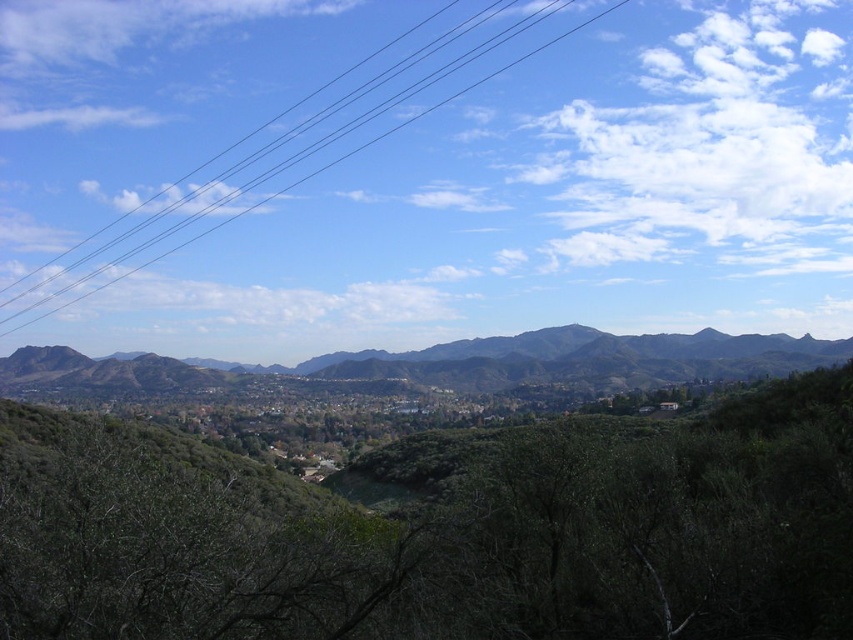
From the picture: You are standing at the edge of the hilly landscape and looking towards the center. You see a green leafy tree at center and a green textured mountain at center. Which object is positioned higher in your field of view?

The green leafy tree at center is positioned higher in your field of view because it is above the green textured mountain at center.

You are a drone operator planning to fly your drone from the green textured mountain at center to the black wire at upper center. Based on the scene, can you determine which object is taller?

The green textured mountain at center is not as tall as the black wire at upper center, so the black wire at upper center is taller.

You are a hiker planning to take a photo of the green textured mountain at center and the black wire at upper center. Which object should you position to your left side when framing the shot?

The black wire at upper center should be positioned to your left side because the green textured mountain at center is to the right of it.